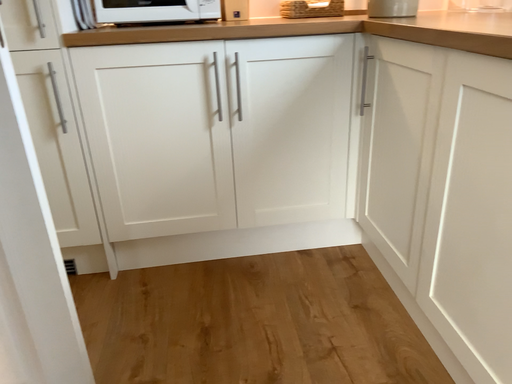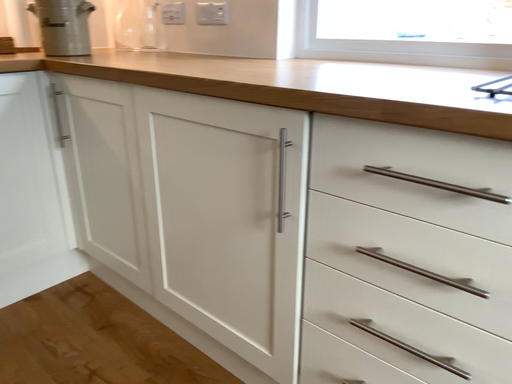
Question: How did the camera likely rotate when shooting the video?

Choices:
 (A) rotated right
 (B) rotated left

Answer: (A)